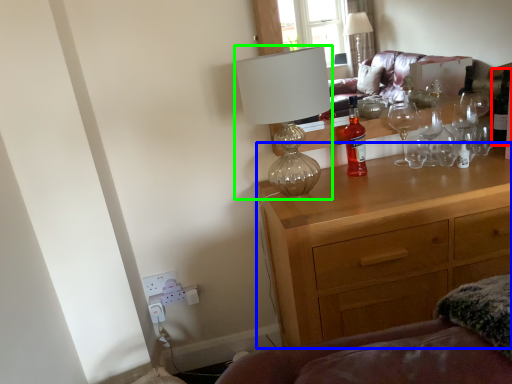
Question: Based on their relative distances, which object is farther from wine bottle (highlighted by a red box)? Choose from chest of drawers (highlighted by a blue box) and lamp (highlighted by a green box).

Choices:
 (A) chest of drawers
 (B) lamp

Answer: (B)